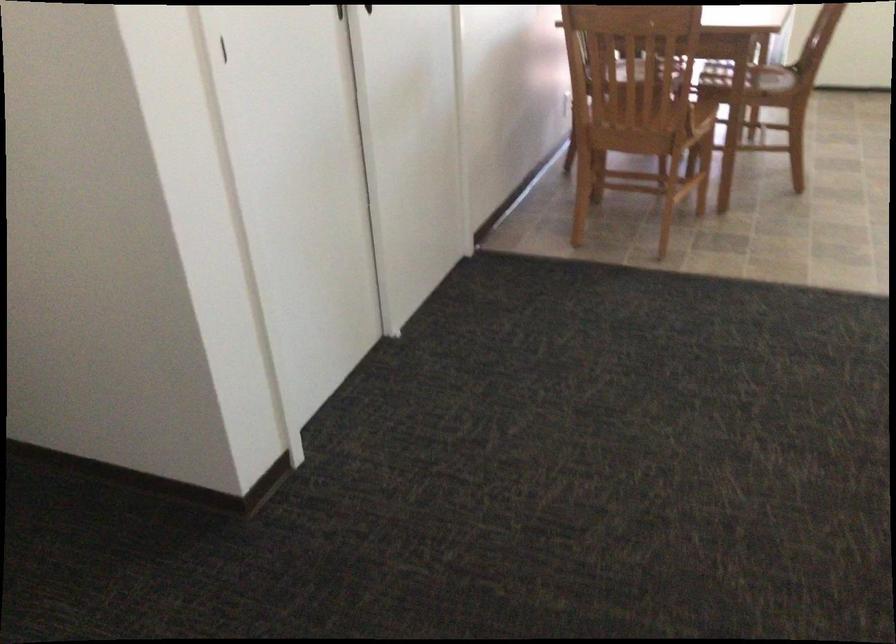
First-person continuous shooting, in which direction is the camera rotating?

The camera's rotation is toward right-down.